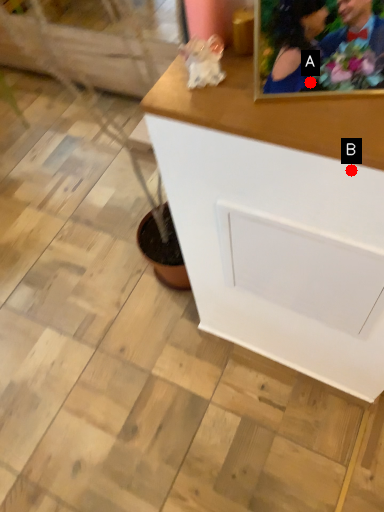
Question: Two points are circled on the image, labeled by A and B beside each circle. Which point is closer to the camera?

Choices:
 (A) A is closer
 (B) B is closer

Answer: (B)